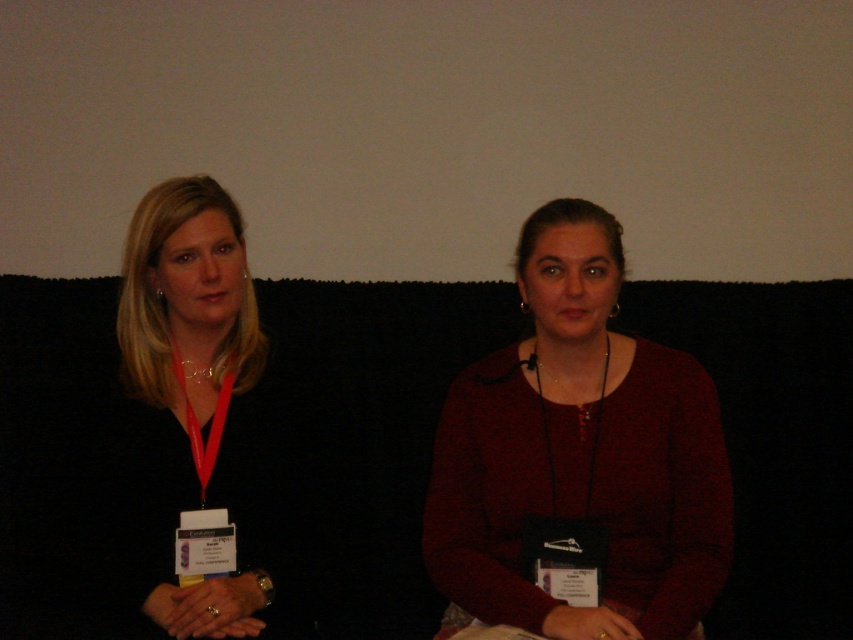
Question: Is black fabric couch at center in front of black matte lanyard at left?

Choices:
 (A) no
 (B) yes

Answer: (A)

Question: Which of the following is the closest to the observer?

Choices:
 (A) (239, 387)
 (B) (834, 394)

Answer: (A)

Question: Which point appears closest to the camera in this image?

Choices:
 (A) (184, 310)
 (B) (583, 230)
 (C) (340, 445)

Answer: (B)

Question: Which of these objects is positioned farthest from the black fabric couch at center?

Choices:
 (A) matte red sweater at center
 (B) black matte lanyard at left

Answer: (A)

Question: Can you confirm if black fabric couch at center is positioned to the right of black matte lanyard at left?

Choices:
 (A) no
 (B) yes

Answer: (B)

Question: Does black fabric couch at center appear on the left side of matte red sweater at center?

Choices:
 (A) yes
 (B) no

Answer: (A)